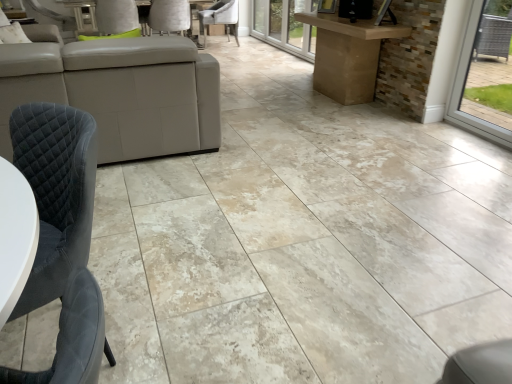
Question: From a real-world perspective, is white leather chair at upper center, which ranks as the 2th chair in bottom-to-top order, under velvet grey chair at center, acting as the third chair starting from the bottom?

Choices:
 (A) no
 (B) yes

Answer: (A)

Question: From the image's perspective, does white leather chair at upper center, arranged as the second chair when viewed from the back, appear higher than velvet grey chair at center, the 3th chair when ordered from front to back?

Choices:
 (A) yes
 (B) no

Answer: (B)

Question: Could you tell me if white leather chair at upper center, arranged as the second chair when viewed from the back, is facing velvet grey chair at center, acting as the third chair starting from the bottom?

Choices:
 (A) yes
 (B) no

Answer: (B)

Question: Does white leather chair at upper center, arranged as the second chair when viewed from the back, have a greater width compared to velvet grey chair at center, the first chair from the top?

Choices:
 (A) no
 (B) yes

Answer: (A)

Question: Is white leather chair at upper center, which appears as the 2th chair when viewed from the top, closer to the viewer compared to velvet grey chair at center, the first chair from the top?

Choices:
 (A) yes
 (B) no

Answer: (A)

Question: Considering the relative sizes of white leather chair at upper center, arranged as the second chair when viewed from the back, and velvet grey chair at center, the first chair from the top, in the image provided, is white leather chair at upper center, arranged as the second chair when viewed from the back, thinner than velvet grey chair at center, the first chair from the top,?

Choices:
 (A) yes
 (B) no

Answer: (A)

Question: From the image's perspective, does velvet grey chair at lower left, the third chair positioned from the top, appear lower than velvet grey chair at center, the first chair positioned from the back?

Choices:
 (A) yes
 (B) no

Answer: (A)

Question: Is velvet grey chair at lower left, acting as the first chair starting from the front, further to camera compared to velvet grey chair at center, the first chair positioned from the back?

Choices:
 (A) yes
 (B) no

Answer: (B)

Question: Is velvet grey chair at lower left, the third chair from the back, directly adjacent to velvet grey chair at center, the first chair positioned from the back?

Choices:
 (A) yes
 (B) no

Answer: (B)

Question: Does velvet grey chair at lower left, which appears as the 1th chair when ordered from the bottom, turn towards velvet grey chair at center, the 3th chair when ordered from front to back?

Choices:
 (A) yes
 (B) no

Answer: (B)

Question: Considering the relative sizes of velvet grey chair at lower left, which appears as the 1th chair when ordered from the bottom, and velvet grey chair at center, acting as the third chair starting from the bottom, in the image provided, is velvet grey chair at lower left, which appears as the 1th chair when ordered from the bottom, wider than velvet grey chair at center, acting as the third chair starting from the bottom,?

Choices:
 (A) no
 (B) yes

Answer: (A)

Question: Is velvet grey chair at lower left, the third chair from the back, not near velvet grey chair at center, the 3th chair when ordered from front to back?

Choices:
 (A) yes
 (B) no

Answer: (A)

Question: From a real-world perspective, is transparent glass door at upper center located beneath velvet grey chair at lower left, the third chair from the back?

Choices:
 (A) yes
 (B) no

Answer: (B)